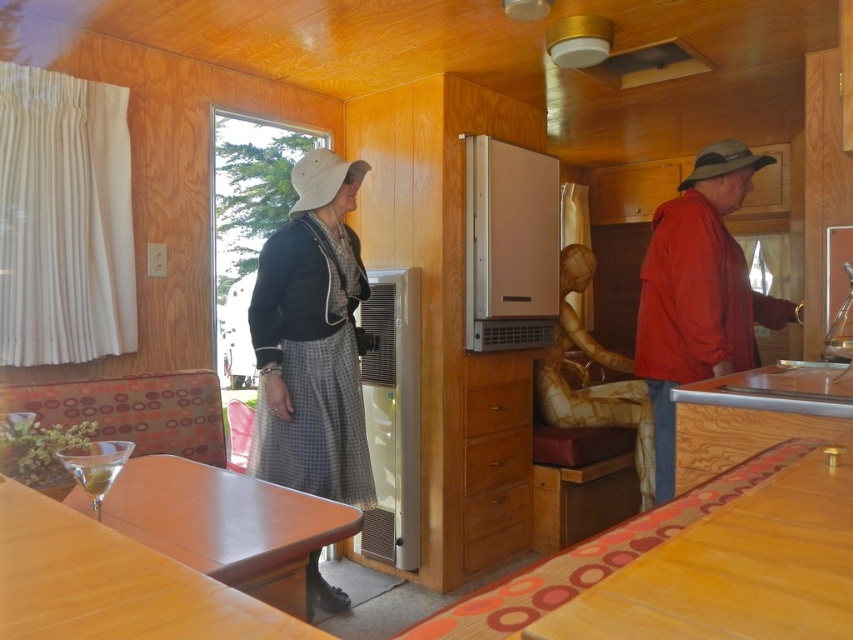
Question: Is red matte jacket at right to the left of green olive at lower left from the viewer's perspective?

Choices:
 (A) yes
 (B) no

Answer: (B)

Question: Among these points, which one is farthest from the camera?

Choices:
 (A) (688, 371)
 (B) (86, 477)
 (C) (328, 490)

Answer: (C)

Question: Considering the relative positions of clear glass martini glass at lower left and green olive at lower left in the image provided, where is clear glass martini glass at lower left located with respect to green olive at lower left?

Choices:
 (A) below
 (B) above

Answer: (A)

Question: Is clear glass martini glass at lower left closer to camera compared to green olive at lower left?

Choices:
 (A) yes
 (B) no

Answer: (B)

Question: Which is nearer to the green olive at lower left?

Choices:
 (A) black woolen jacket at center
 (B) red matte jacket at right

Answer: (A)

Question: Which of the following is the farthest from the observer?

Choices:
 (A) (322, 278)
 (B) (601, 64)
 (C) (103, 476)
 (D) (99, 451)

Answer: (B)